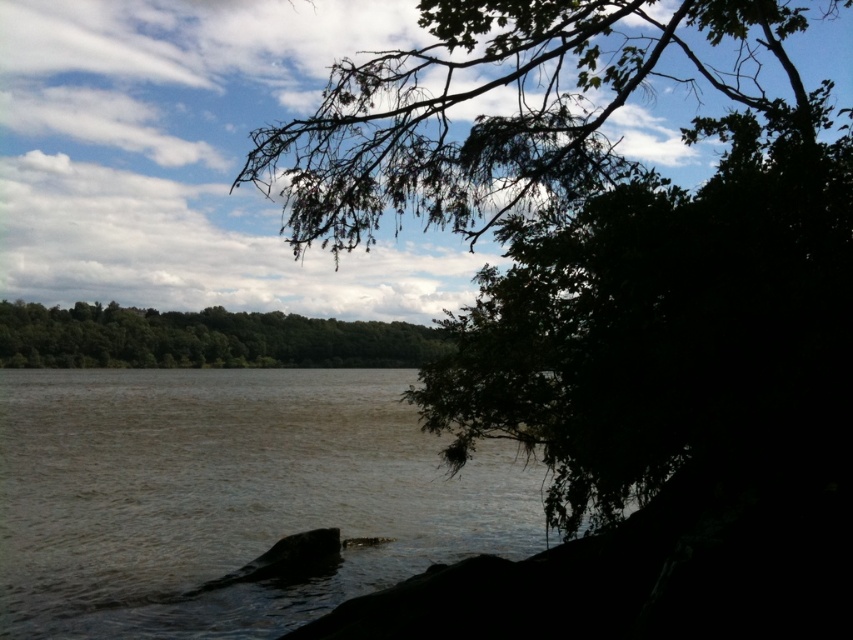
Is brown murky water at center below green leafy branch at upper center?

Yes, brown murky water at center is below green leafy branch at upper center.

Measure the distance between brown murky water at center and camera.

brown murky water at center is 14.72 meters from camera.

What are the coordinates of `brown murky water at center` in the screenshot? It's located at (227, 497).

Does point (605, 152) come behind point (440, 336)?

No, (605, 152) is in front of (440, 336).

Can you confirm if green leafy branch at upper center is positioned to the right of green leafy trees at center?

Yes, green leafy branch at upper center is to the right of green leafy trees at center.

Is point (730, 97) positioned behind point (132, 342)?

That is False.

I want to click on green leafy branch at upper center, so click(x=506, y=113).

The width and height of the screenshot is (853, 640). I want to click on brown murky water at center, so click(x=227, y=497).

Is brown murky water at center above green leafy trees at center?

No.

Who is more forward, (178,417) or (403,330)?

Point (403,330) is in front.

Identify the location of brown murky water at center. The width and height of the screenshot is (853, 640). (227, 497).